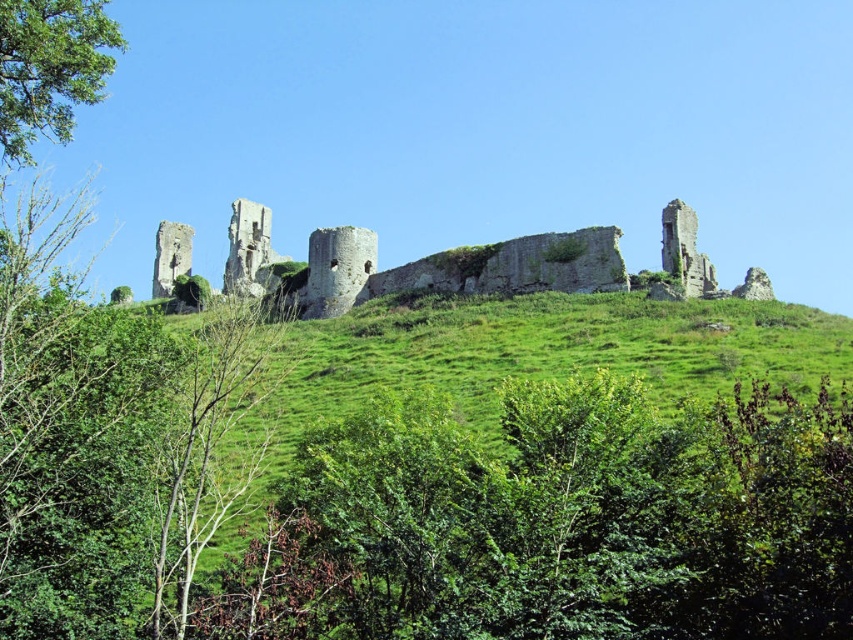
Question: Does weathered stone ruins at center have a larger size compared to green leafy tree at upper left?

Choices:
 (A) yes
 (B) no

Answer: (A)

Question: Which point is closer to the camera?

Choices:
 (A) green leafy tree at upper left
 (B) weathered stone ruins at center

Answer: (A)

Question: Which point is closer to the camera?

Choices:
 (A) weathered stone ruins at center
 (B) green leafy tree at upper left

Answer: (B)

Question: Where is weathered stone ruins at center located in relation to green leafy tree at upper left in the image?

Choices:
 (A) above
 (B) below

Answer: (B)

Question: Is weathered stone ruins at center smaller than green leafy tree at upper left?

Choices:
 (A) yes
 (B) no

Answer: (B)